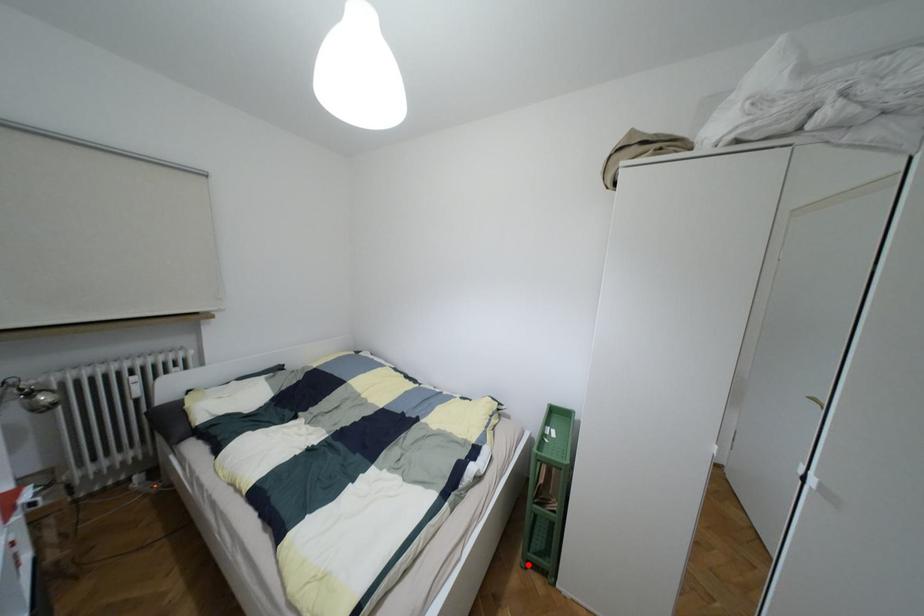
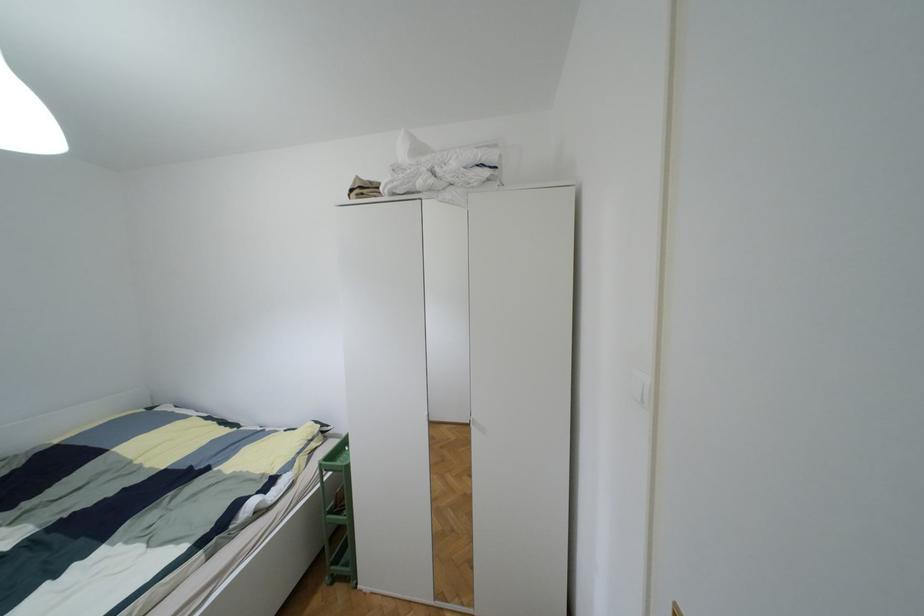
In the second image, find the point that corresponds to the highlighted location in the first image.

(333, 578)